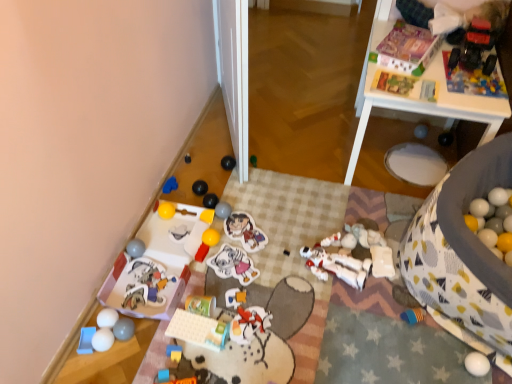
Find the location of `free point above matte cardboard box at upper right, which is the 24th toy in left-to-right order (from a real-world perspective)`. free point above matte cardboard box at upper right, which is the 24th toy in left-to-right order (from a real-world perspective) is located at coordinates (413, 46).